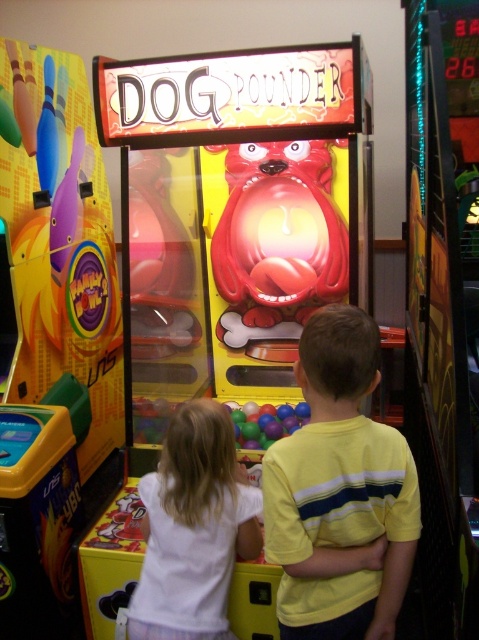
You are a photographer trying to capture the yellow striped shirt at center in the image. What are the coordinates where you should focus your camera?

The coordinates to focus on are point (340, 493).

You are a game designer analyzing the layout of the Dog Pounder arcade machine. You notice two points marked on the screen at coordinates point (303, 627) and point (280, 422). Based on the scene description, which point is closer to the front of the machine?

Point (303, 627) is closer to the front of the machine because it is positioned in front of point (280, 422) according to the description.

You are a photographer trying to capture the game machine and the two children in the scene. You notice the yellow striped shirt at center and the multicolored plastic balls at center. Which object should you focus on first to ensure both the game machine and the children are in sharp focus?

The yellow striped shirt at center is closer to the viewer than the multicolored plastic balls at center. To ensure both are in focus, focus on the yellow striped shirt at center since it is closer, and the depth of field will likely include the farther object as well.